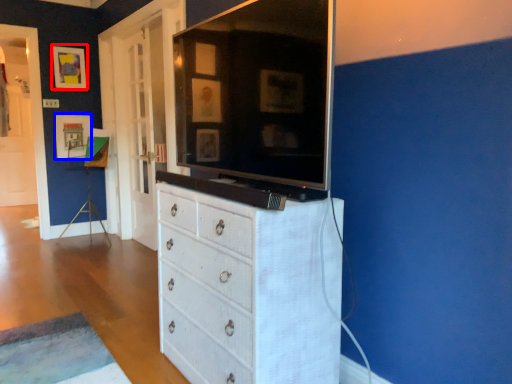
Question: Which object appears farthest to the camera in this image, picture frame (highlighted by a red box) or picture frame (highlighted by a blue box)?

Choices:
 (A) picture frame
 (B) picture frame

Answer: (B)